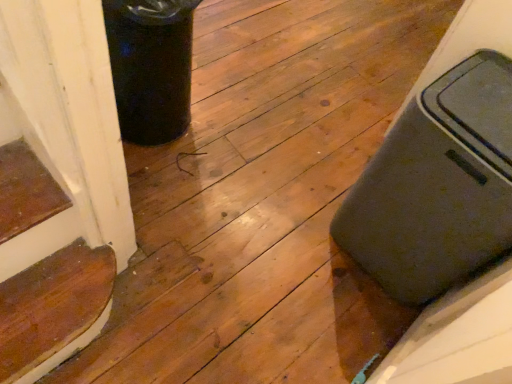
Locate an element on the screen. This screenshot has width=512, height=384. free space in front of matte gray suitcase at right is located at coordinates (344, 322).